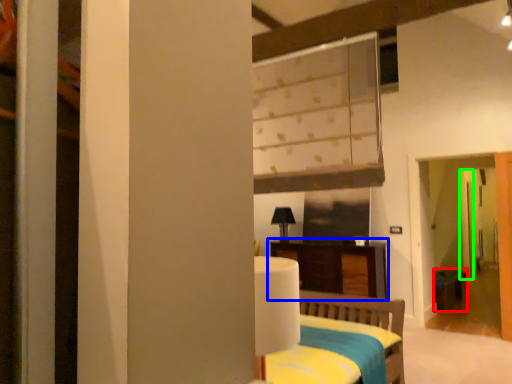
Question: Which is farther away from table (highlighted by a red box)? furniture (highlighted by a blue box) or door (highlighted by a green box)?

Choices:
 (A) furniture
 (B) door

Answer: (A)